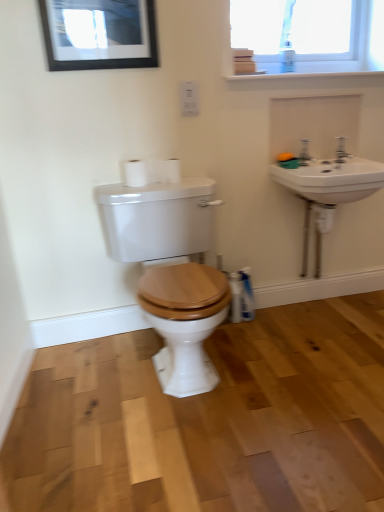
Where is `vacant region to the left of white matte toilet paper at upper center, the second toilet paper from the left`? The image size is (384, 512). vacant region to the left of white matte toilet paper at upper center, the second toilet paper from the left is located at coordinates (140, 185).